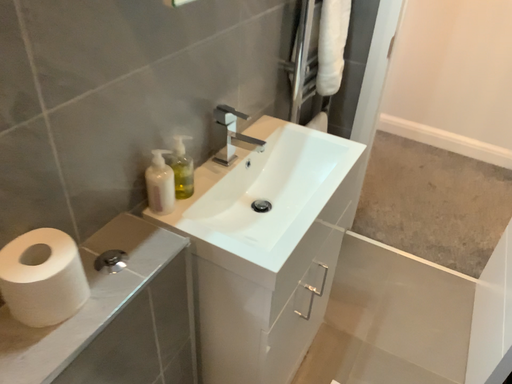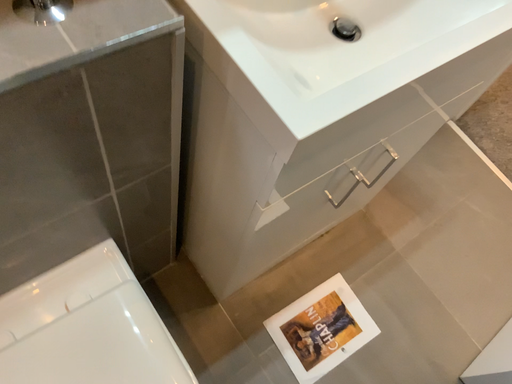
Question: Which way did the camera rotate in the video?

Choices:
 (A) rotated downward
 (B) rotated upward

Answer: (A)